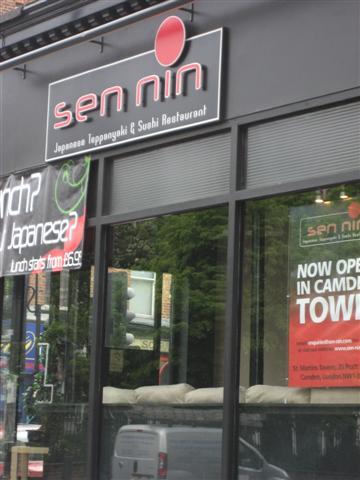
Image resolution: width=360 pixels, height=480 pixels. Find the location of `table`. table is located at coordinates (31, 449).